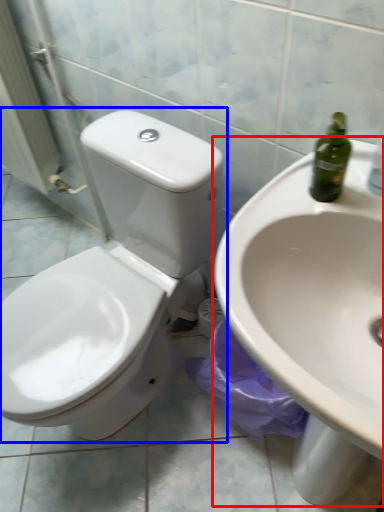
Question: Among these objects, which one is nearest to the camera, sink (highlighted by a red box) or toilet (highlighted by a blue box)?

Choices:
 (A) sink
 (B) toilet

Answer: (A)